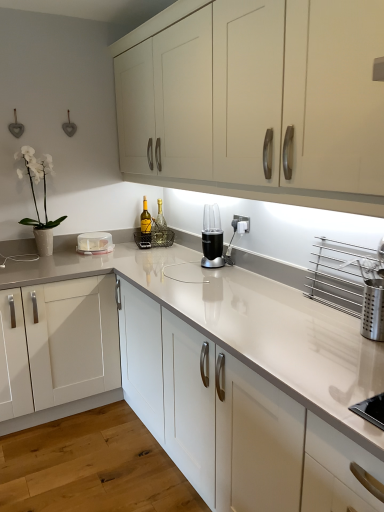
Question: Is white glossy countertop at center facing away from clear glass bottle at center, arranged as the first bottle when viewed from the right?

Choices:
 (A) no
 (B) yes

Answer: (A)

Question: Considering the relative sizes of white glossy countertop at center and clear glass bottle at center, which appears as the 2th bottle when viewed from the left, in the image provided, is white glossy countertop at center wider than clear glass bottle at center, which appears as the 2th bottle when viewed from the left,?

Choices:
 (A) no
 (B) yes

Answer: (B)

Question: From a real-world perspective, is white glossy countertop at center located beneath clear glass bottle at center, arranged as the first bottle when viewed from the right?

Choices:
 (A) yes
 (B) no

Answer: (A)

Question: Is white glossy countertop at center far away from clear glass bottle at center, which appears as the 2th bottle when viewed from the left?

Choices:
 (A) no
 (B) yes

Answer: (B)

Question: Does white glossy countertop at center lie behind clear glass bottle at center, arranged as the first bottle when viewed from the right?

Choices:
 (A) no
 (B) yes

Answer: (A)

Question: Is white glossy countertop at center in front of or behind yellow glass bottle at center, the second bottle viewed from the right, in the image?

Choices:
 (A) behind
 (B) front

Answer: (B)

Question: Considering the positions of white glossy countertop at center and yellow glass bottle at center, the 1th bottle in the left-to-right sequence, in the image, is white glossy countertop at center taller or shorter than yellow glass bottle at center, the 1th bottle in the left-to-right sequence,?

Choices:
 (A) tall
 (B) short

Answer: (A)

Question: From a real-world perspective, is white glossy countertop at center above or below yellow glass bottle at center, the 1th bottle in the left-to-right sequence?

Choices:
 (A) below
 (B) above

Answer: (A)

Question: Considering the positions of white glossy countertop at center and yellow glass bottle at center, the second bottle viewed from the right, in the image, is white glossy countertop at center bigger or smaller than yellow glass bottle at center, the second bottle viewed from the right,?

Choices:
 (A) small
 (B) big

Answer: (B)

Question: Considering the positions of matte white cabinets at upper center and white glossy countertop at center in the image, is matte white cabinets at upper center taller or shorter than white glossy countertop at center?

Choices:
 (A) tall
 (B) short

Answer: (B)

Question: From the image's perspective, is matte white cabinets at upper center located above or below white glossy countertop at center?

Choices:
 (A) above
 (B) below

Answer: (A)

Question: Based on their sizes in the image, would you say matte white cabinets at upper center is bigger or smaller than white glossy countertop at center?

Choices:
 (A) big
 (B) small

Answer: (B)

Question: In terms of width, does matte white cabinets at upper center look wider or thinner when compared to white glossy countertop at center?

Choices:
 (A) thin
 (B) wide

Answer: (A)

Question: Considering the positions of black plastic blender at center and white glossy vase at upper left in the image, is black plastic blender at center wider or thinner than white glossy vase at upper left?

Choices:
 (A) thin
 (B) wide

Answer: (A)

Question: Is point (206, 240) closer or farther from the camera than point (44, 156)?

Choices:
 (A) farther
 (B) closer

Answer: (B)